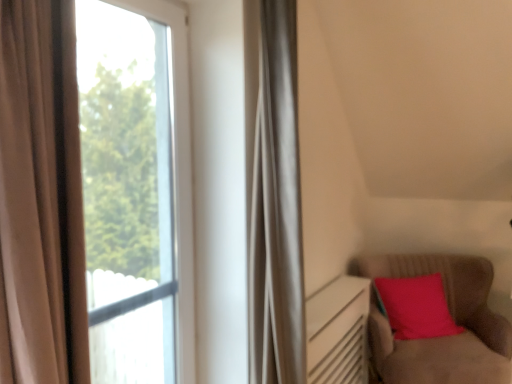
Question: Is transparent glass window at left, the 1th window positioned from the left, inside the boundaries of velvet-like brown armchair at lower right, or outside?

Choices:
 (A) outside
 (B) inside

Answer: (A)

Question: Is transparent glass window at left, arranged as the 2th window when viewed from the right, taller or shorter than velvet-like brown armchair at lower right?

Choices:
 (A) tall
 (B) short

Answer: (A)

Question: Which of these objects is positioned farthest from the velvet-like brown armchair at lower right?

Choices:
 (A) transparent glass window at left, which ranks as the 1th window in right-to-left order
 (B) transparent glass window at left, arranged as the 2th window when viewed from the right

Answer: (A)

Question: Which is farther from the transparent glass window at left, the 1th window positioned from the left?

Choices:
 (A) velvet-like brown armchair at lower right
 (B) transparent glass window at left, the 2th window in the left-to-right sequence

Answer: (B)